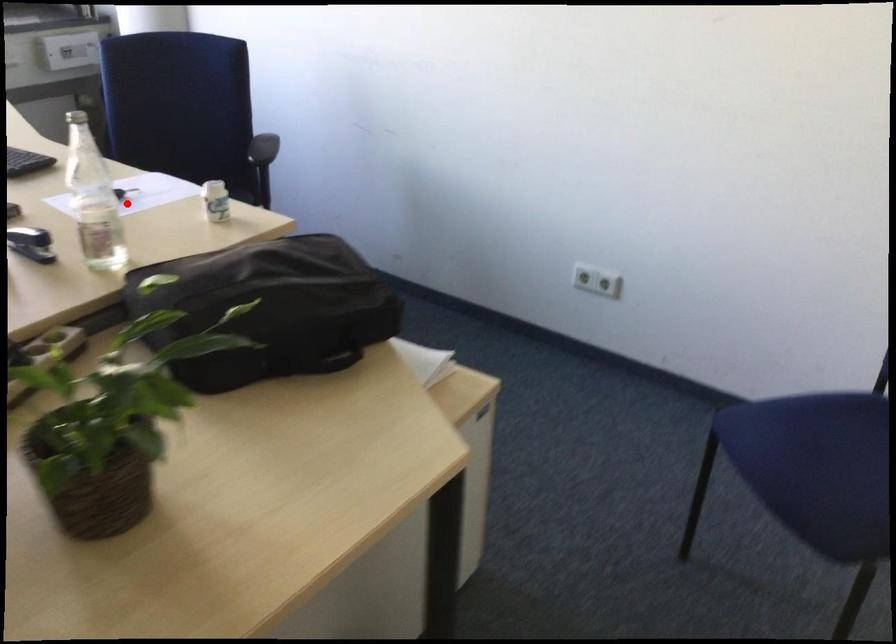
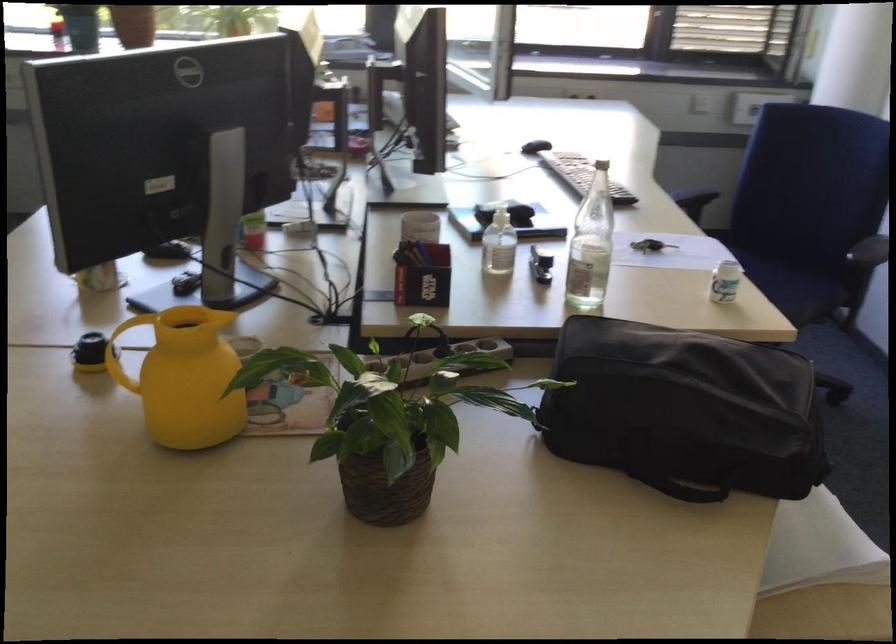
In the second image, find the point that corresponds to the highlighted location in the first image.

(651, 245)